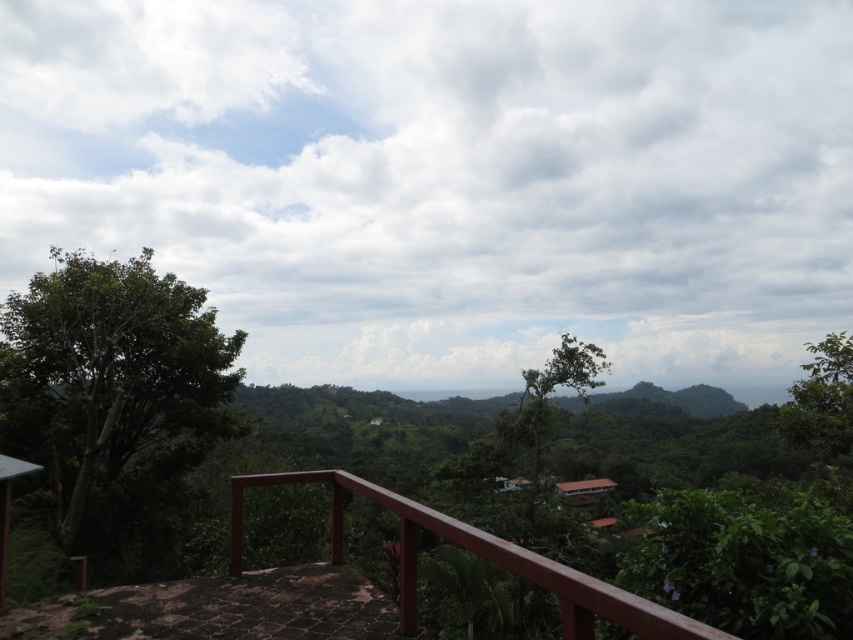
Consider the image. Who is more distant from viewer, (410, 516) or (816, 408)?

The point (816, 408) is behind.

Can you confirm if brown wooden railing at lower center is bigger than green leafy tree at right?

Actually, brown wooden railing at lower center might be smaller than green leafy tree at right.

Is point (115, 632) farther from viewer compared to point (814, 403)?

No, it is not.

Identify the location of brown wooden railing at lower center. The image size is (853, 640). (357, 588).

Who is taller, brown wooden railing at lower center or green leafy tree at center?

green leafy tree at center

Who is more distant from viewer, [410,536] or [523,442]?

The point [523,442] is more distant.

You are a GUI agent. You are given a task and a screenshot of the screen. Output one action in this format:
    pyautogui.click(x=<x>, y=<y>)
    Task: Click on the brown wooden railing at lower center
    The image size is (853, 640).
    Given the screenshot: What is the action you would take?
    pyautogui.click(x=357, y=588)

Can you confirm if green leafy tree at left is positioned below brown wooden railing at lower center?

Correct, green leafy tree at left is located below brown wooden railing at lower center.

Who is more forward, (167, 365) or (357, 586)?

Point (357, 586) is more forward.

Where is `green leafy tree at left`? This screenshot has height=640, width=853. green leafy tree at left is located at coordinates (115, 371).